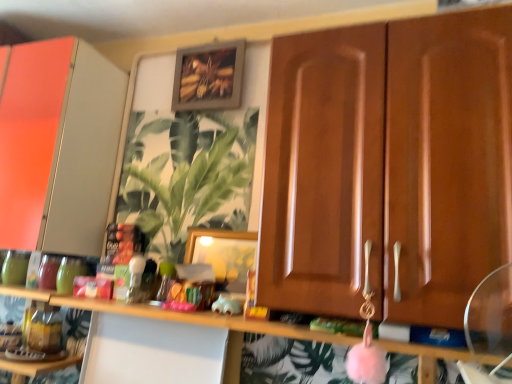
Question: From their relative heights in the image, would you say matte white cabinet at left, the 2th cabinetry when ordered from right to left, is taller or shorter than wooden cabinet doors at center, the first cabinetry viewed from the right?

Choices:
 (A) tall
 (B) short

Answer: (A)

Question: Is matte white cabinet at left, the 2th cabinetry when ordered from right to left, situated inside wooden cabinet doors at center, the first cabinetry viewed from the right, or outside?

Choices:
 (A) outside
 (B) inside

Answer: (A)

Question: Which of these objects is positioned farthest from the wooden frame at upper center, marked as the 1th picture frame in a top-to-bottom arrangement?

Choices:
 (A) wooden cabinet doors at center, which is the first cabinetry in front-to-back order
 (B) pink fuzzy ball at center
 (C) wooden picture frame at center, the 2th picture frame when ordered from top to bottom
 (D) matte white cabinet at left, the second cabinetry when ordered from front to back
 (E) green leafy plant at center

Answer: (B)

Question: Which of these objects is positioned farthest from the green leafy plant at center?

Choices:
 (A) matte white cabinet at left, the second cabinetry when ordered from front to back
 (B) wooden frame at upper center, marked as the 1th picture frame in a top-to-bottom arrangement
 (C) pink fuzzy ball at center
 (D) wooden picture frame at center, the 2th picture frame positioned from the back
 (E) wooden cabinet doors at center, which is the 2th cabinetry in left-to-right order

Answer: (E)